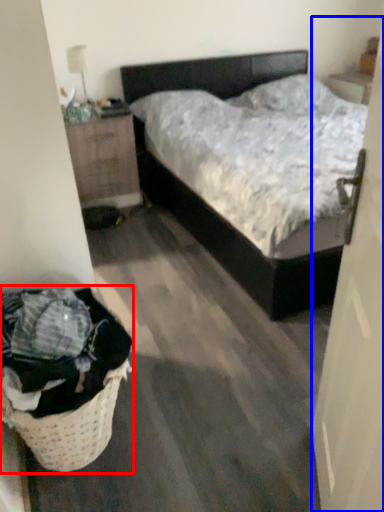
Question: Which point is closer to the camera, laundry basket (highlighted by a red box) or door (highlighted by a blue box)?

Choices:
 (A) laundry basket
 (B) door

Answer: (B)